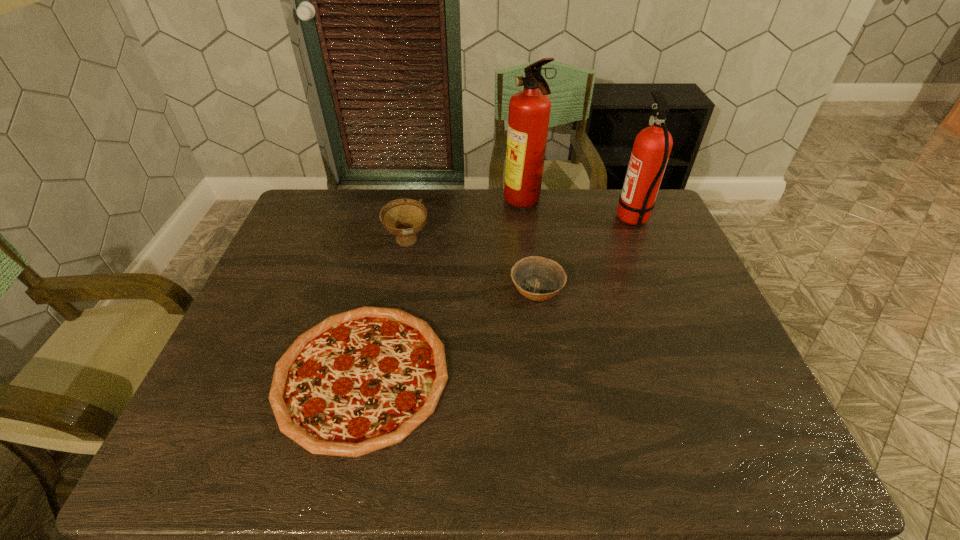
This screenshot has height=540, width=960. In order to click on free location located 0.190m on the front-facing side of the left fire extinguisher in this screenshot , I will do `click(449, 203)`.

Image resolution: width=960 pixels, height=540 pixels. In order to click on vacant space located 0.130m on the front-facing side of the left fire extinguisher in this screenshot , I will do `click(467, 203)`.

You are a GUI agent. You are given a task and a screenshot of the screen. Output one action in this format:
    pyautogui.click(x=<x>, y=<y>)
    Task: Click on the free space located on the handle side of the second tallest object
    The image size is (960, 540).
    Given the screenshot: What is the action you would take?
    pyautogui.click(x=529, y=219)

Identify the location of vacant region located on the handle side of the second tallest object. This screenshot has height=540, width=960. (543, 219).

Image resolution: width=960 pixels, height=540 pixels. Identify the location of blank area located on the handle side of the second tallest object. (586, 219).

Locate an element on the screen. Image resolution: width=960 pixels, height=540 pixels. blank space located on the right of the third tallest object is located at coordinates [514, 242].

You are a GUI agent. You are given a task and a screenshot of the screen. Output one action in this format:
    pyautogui.click(x=<x>, y=<y>)
    Task: Click on the vacant space situated on the back of the second shortest object
    
    Given the screenshot: What is the action you would take?
    pyautogui.click(x=527, y=211)

This screenshot has height=540, width=960. I want to click on vacant space located on the right of the shortest object, so click(x=564, y=375).

Locate an element on the screen. The image size is (960, 540). soup bowl that is at the far edge is located at coordinates (404, 218).

I want to click on object present at the near edge, so click(362, 380).